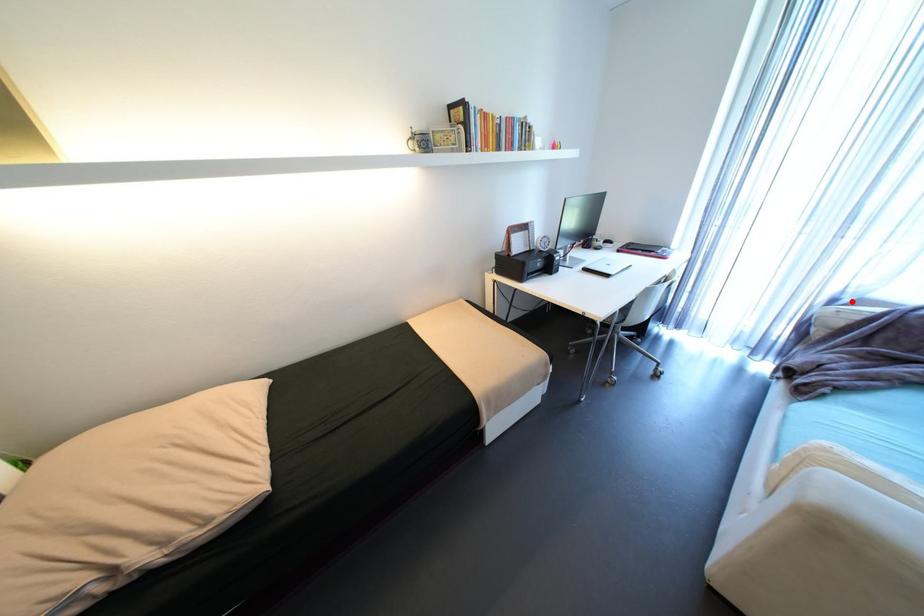
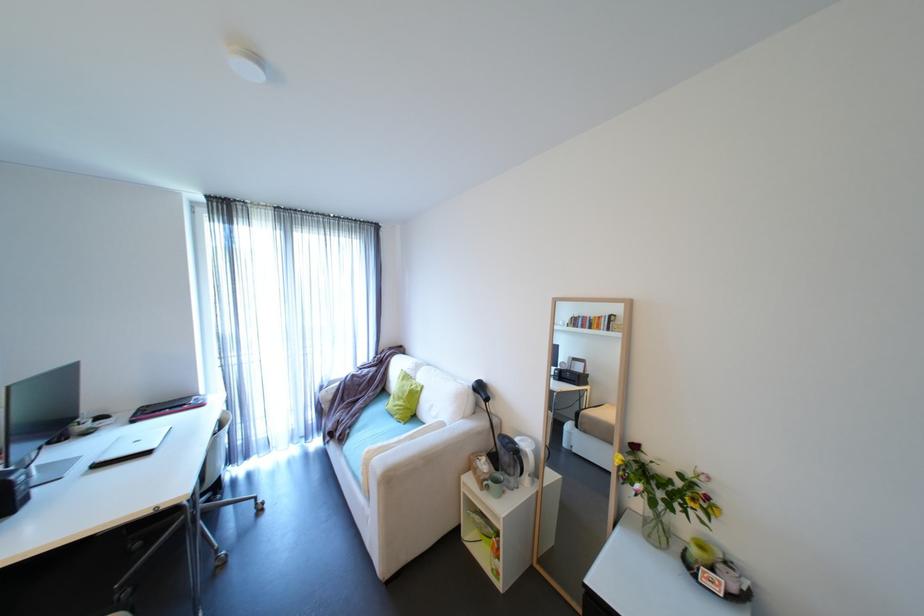
Locate, in the second image, the point that corresponds to the highlighted location in the first image.

(333, 386)